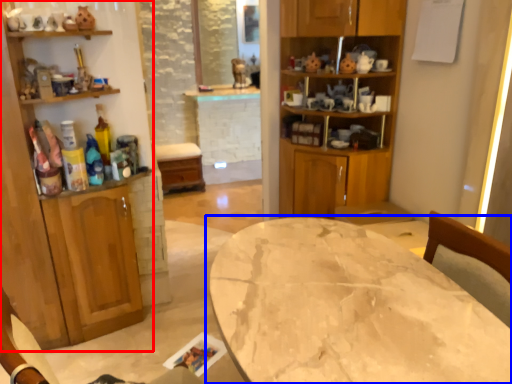
Question: Which point is further to the camera, cabinetry (highlighted by a red box) or table (highlighted by a blue box)?

Choices:
 (A) cabinetry
 (B) table

Answer: (A)